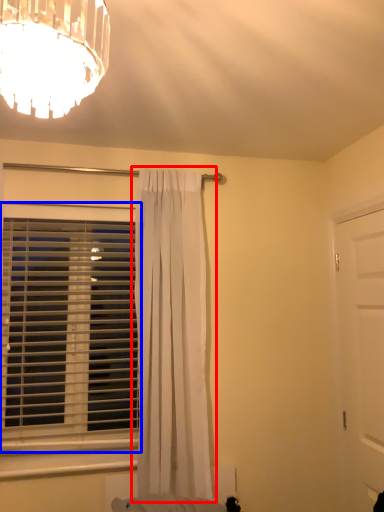
Question: Which object is closer to the camera taking this photo, curtain (highlighted by a red box) or window blind (highlighted by a blue box)?

Choices:
 (A) curtain
 (B) window blind

Answer: (A)